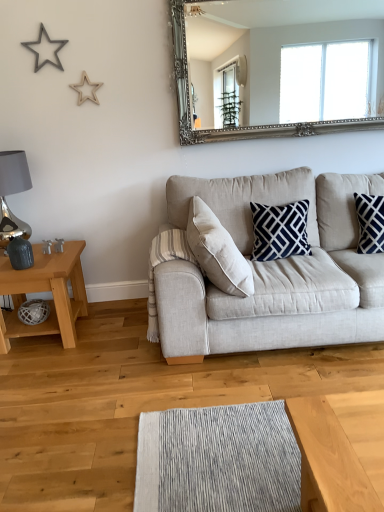
Locate an element on the screen. The width and height of the screenshot is (384, 512). free space between matte wooden table at left and beige fabric couch at center is located at coordinates (115, 333).